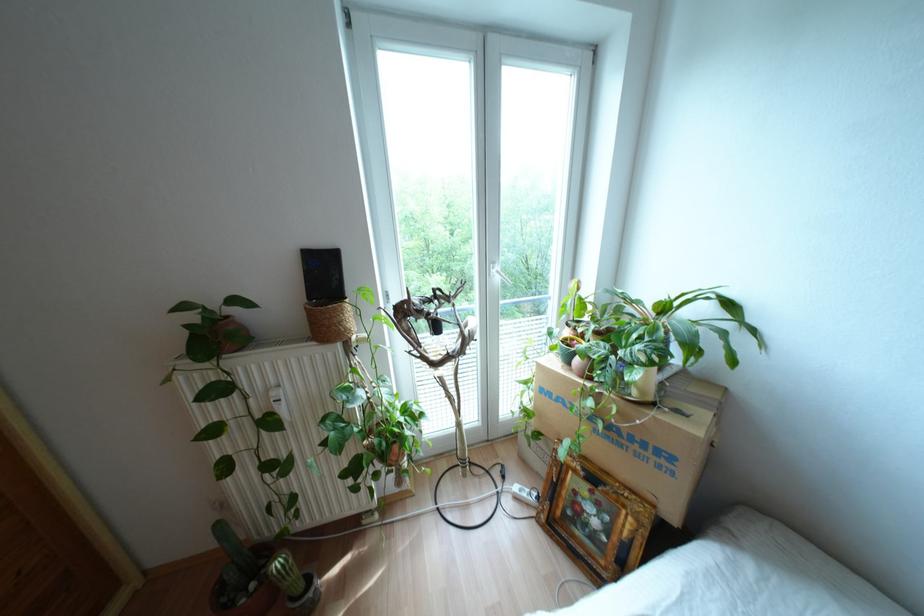
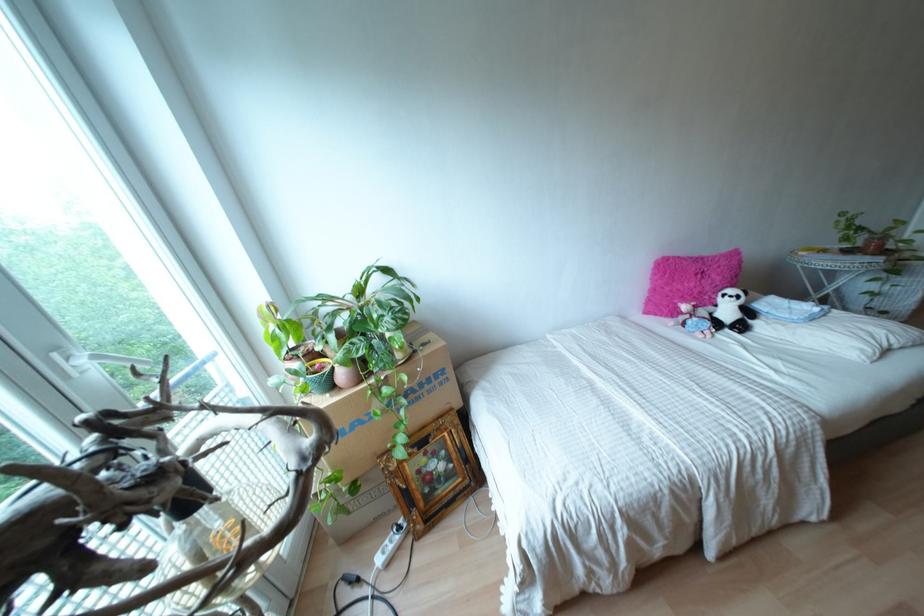
First-person continuous shooting, in which direction is the camera rotating?

The rotation direction of the camera is right-down.